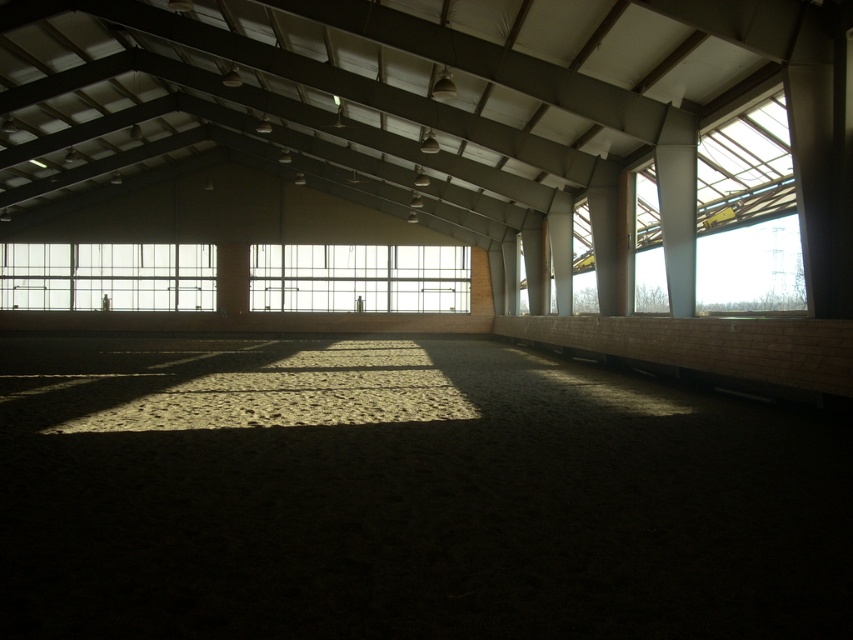
Does point (717, 292) come in front of point (114, 285)?

That is True.

Is transparent glass window at upper right further to the viewer compared to clear glass window at upper left?

No, it is in front of clear glass window at upper left.

The image size is (853, 640). What are the coordinates of `transparent glass window at upper right` in the screenshot? It's located at (746, 170).

Can you confirm if clear glass window at center is positioned to the right of clear glass window at upper left?

Indeed, clear glass window at center is positioned on the right side of clear glass window at upper left.

Between clear glass window at center and clear glass window at upper left, which one has less height?

clear glass window at upper left

Measure the distance between point (277, 284) and camera.

35.45 meters

Locate an element on the screen. Image resolution: width=853 pixels, height=640 pixels. clear glass window at center is located at coordinates (358, 276).

Who is higher up, transparent glass window at upper right or clear glass window at center?

clear glass window at center is above.

In the scene shown: Does transparent glass window at upper right appear on the left side of clear glass window at center?

In fact, transparent glass window at upper right is to the right of clear glass window at center.

Which is in front, point (705, 184) or point (335, 275)?

Point (705, 184)

You are a GUI agent. You are given a task and a screenshot of the screen. Output one action in this format:
    pyautogui.click(x=<x>, y=<y>)
    Task: Click on the transparent glass window at upper right
    The height and width of the screenshot is (640, 853).
    Given the screenshot: What is the action you would take?
    pyautogui.click(x=746, y=170)